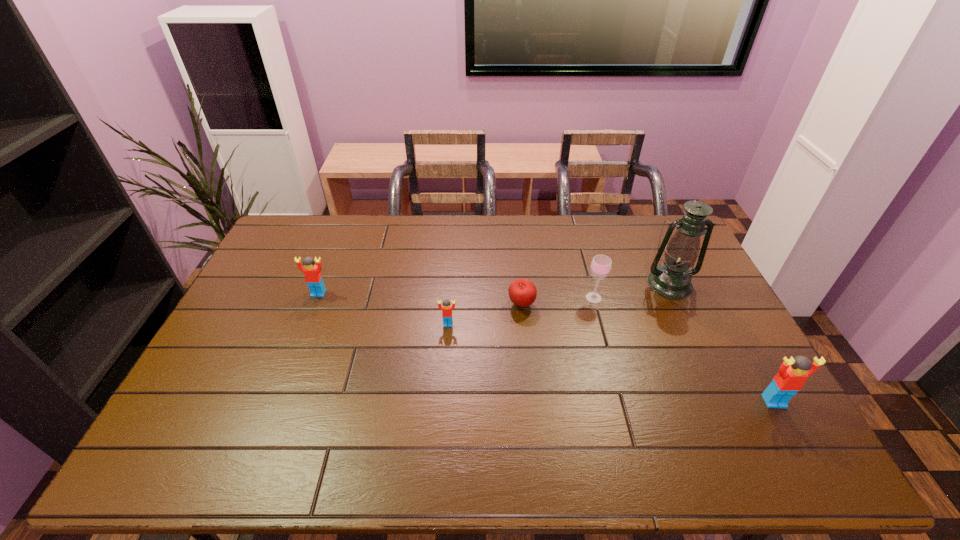
The width and height of the screenshot is (960, 540). Find the location of `free location located on the face of the second Lego from left to right`. free location located on the face of the second Lego from left to right is located at coordinates (444, 377).

I want to click on vacant space positioned on the back of the tallest object, so click(652, 245).

This screenshot has width=960, height=540. I want to click on vacant space located 0.260m on the right of the apple, so click(617, 305).

The width and height of the screenshot is (960, 540). I want to click on vacant region located 0.370m on the back of the wineglass, so click(x=574, y=226).

I want to click on object located at the near edge, so click(793, 373).

Identify the location of Lego positioned at the right edge. (793, 373).

You are a GUI agent. You are given a task and a screenshot of the screen. Output one action in this format:
    pyautogui.click(x=<x>, y=<y>)
    Task: Click on the oil lamp that is at the right edge
    
    Given the screenshot: What is the action you would take?
    pyautogui.click(x=672, y=279)

Find the location of `object that is positioned at the near right corner`. object that is positioned at the near right corner is located at coordinates (793, 373).

Find the location of a particular element. vacant area at the far edge is located at coordinates (415, 226).

This screenshot has width=960, height=540. In the image, there is a desktop. Find the location of `free space at the near edge`. free space at the near edge is located at coordinates (661, 400).